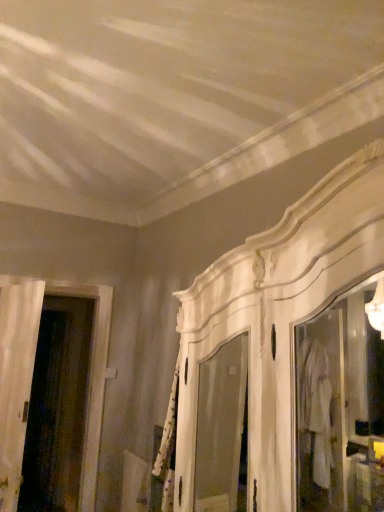
Question: In terms of size, does transparent glass screen door at left appear bigger or smaller than white wood door at left?

Choices:
 (A) small
 (B) big

Answer: (B)

Question: Is transparent glass screen door at left wider or thinner than white wood door at left?

Choices:
 (A) thin
 (B) wide

Answer: (B)

Question: In terms of height, does transparent glass screen door at left look taller or shorter compared to white wood door at left?

Choices:
 (A) tall
 (B) short

Answer: (A)

Question: Is white wood door at left taller or shorter than transparent glass screen door at left?

Choices:
 (A) tall
 (B) short

Answer: (B)

Question: Is white wood door at left in front of or behind transparent glass screen door at left in the image?

Choices:
 (A) front
 (B) behind

Answer: (A)

Question: Choose the correct answer: Is white wood door at left inside transparent glass screen door at left or outside it?

Choices:
 (A) inside
 (B) outside

Answer: (B)

Question: In terms of width, does white wood door at left look wider or thinner when compared to transparent glass screen door at left?

Choices:
 (A) thin
 (B) wide

Answer: (A)